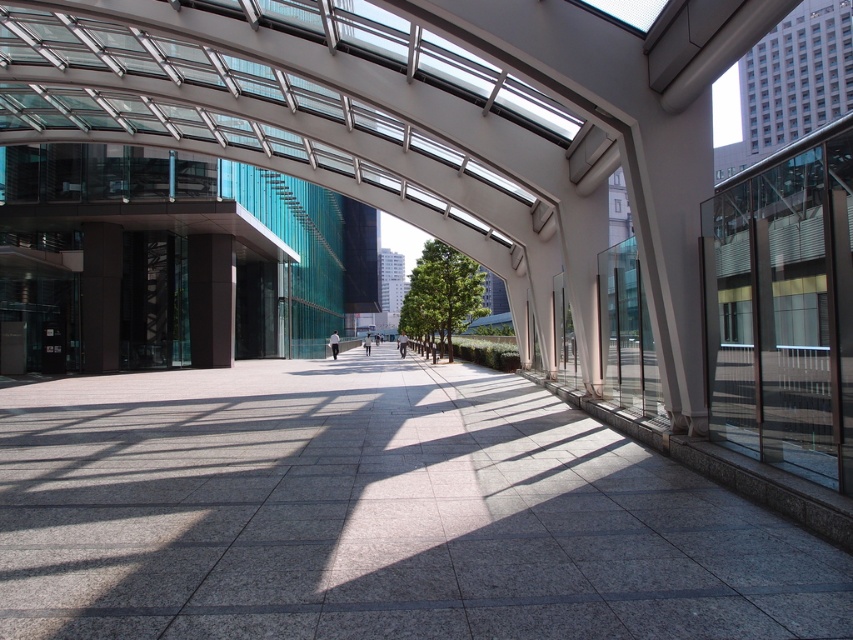
You are standing at the entrance of the plaza and want to walk towards the gray polished stone pavement at center and the satin black pillar at center. Which object will you encounter first?

The satin black pillar at center will be encountered first because it is positioned to the left of the gray polished stone pavement at center, meaning it is closer to the entrance where you are standing.

You are a visitor standing in the plaza and want to take a photo of the gray polished stone pavement at center and the satin black pillar at center. Which object is shorter?

The gray polished stone pavement at center is not as tall as the satin black pillar at center, so the gray polished stone pavement at center is shorter.